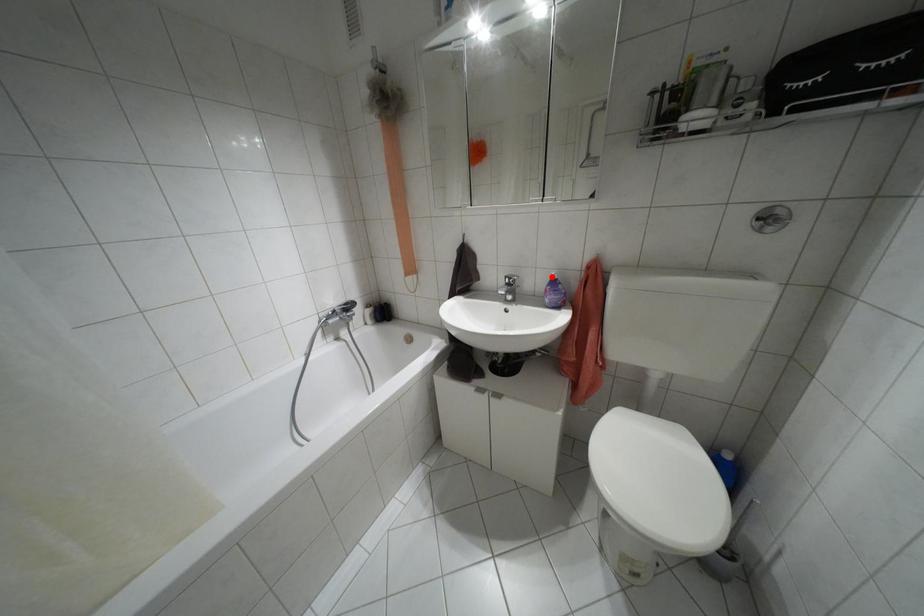
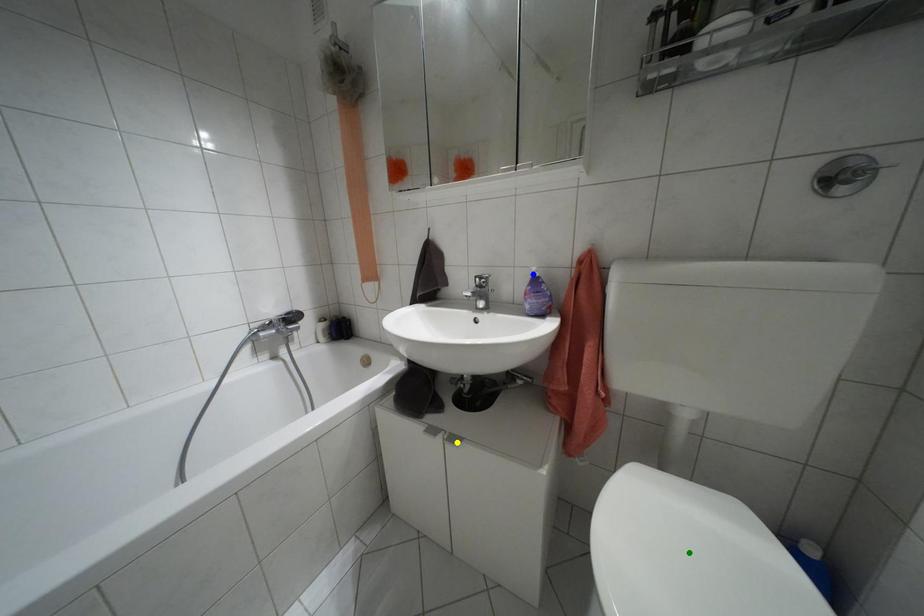
Question: I am providing you with two images of the same scene from different viewpoints. A red point is marked on the first image. You are given multiple points on the second image. Can you choose the point in image 2 that corresponds to the point in image 1?

Choices:
 (A) blue point
 (B) green point
 (C) yellow point

Answer: (A)